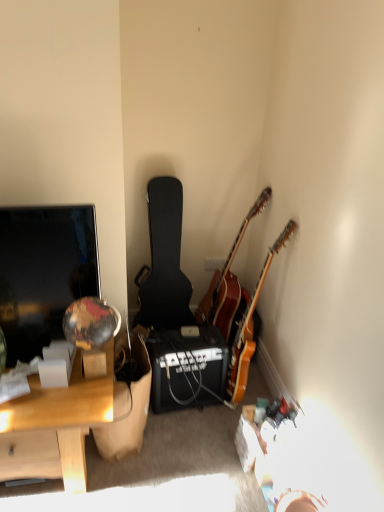
Question: Looking at the image, does black matte amplifier at center seem bigger or smaller compared to matte black screen at left?

Choices:
 (A) small
 (B) big

Answer: (B)

Question: Looking at their shapes, would you say black matte amplifier at center is wider or thinner than matte black screen at left?

Choices:
 (A) thin
 (B) wide

Answer: (B)

Question: Considering the real-world distances, which object is closest to the black matte amplifier at center?

Choices:
 (A) matte black screen at left
 (B) wooden acoustic guitar at corner, which is the second guitar in left-to-right order
 (C) wooden desk at left
 (D) black textured guitar case at center, the 3th guitar viewed from the right
 (E) wooden acoustic guitar at upper right, the first guitar positioned from the right

Answer: (E)

Question: Considering the real-world distances, which object is farthest from the black textured guitar case at center, which is the 1th guitar in left-to-right order?

Choices:
 (A) matte black screen at left
 (B) black matte amplifier at center
 (C) wooden acoustic guitar at upper right, marked as the third guitar in a left-to-right arrangement
 (D) wooden desk at left
 (E) wooden acoustic guitar at corner, which is the second guitar in left-to-right order

Answer: (D)